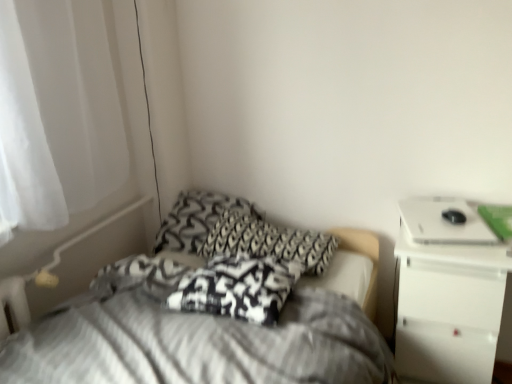
Question: In the image, is white sheer curtain at left positioned in front of or behind textured gray bed at center?

Choices:
 (A) front
 (B) behind

Answer: (B)

Question: Considering the relative positions of white sheer curtain at left and textured gray bed at center in the image provided, is white sheer curtain at left to the left or to the right of textured gray bed at center?

Choices:
 (A) left
 (B) right

Answer: (A)

Question: Which of these objects is positioned farthest from the black and white patterned pillow at center, marked as the third pillow in a back-to-front arrangement?

Choices:
 (A) white sheer curtain at left
 (B) black and white patterned pillow at center, which ranks as the 2th pillow in back-to-front order
 (C) white glossy laptop at upper right
 (D) white glossy nightstand at upper right
 (E) textured gray bed at center

Answer: (A)

Question: Estimate the real-world distances between objects in this image. Which object is farther from the white sheer curtain at left?

Choices:
 (A) black and white patterned pillow at center, which ranks as the 2th pillow in back-to-front order
 (B) white glossy laptop at upper right
 (C) textured gray bed at center
 (D) black and white patterned pillow at center, the 1th pillow from the front
 (E) white glossy nightstand at upper right

Answer: (E)